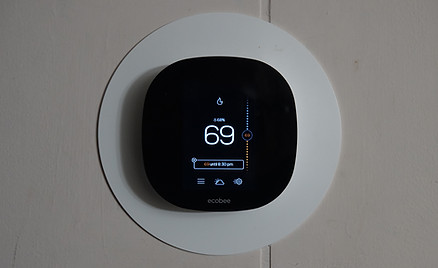
This screenshot has height=268, width=438. Find the location of `black thermostat`. black thermostat is located at coordinates (x=165, y=72).